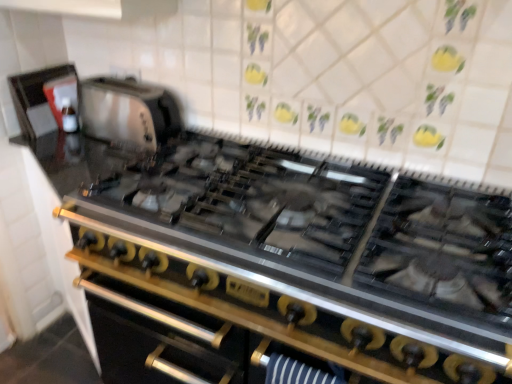
Where is `free point in front of matte black kettle at upper left, which ranks as the 1th appliance in left-to-right order`? This screenshot has width=512, height=384. free point in front of matte black kettle at upper left, which ranks as the 1th appliance in left-to-right order is located at coordinates click(45, 137).